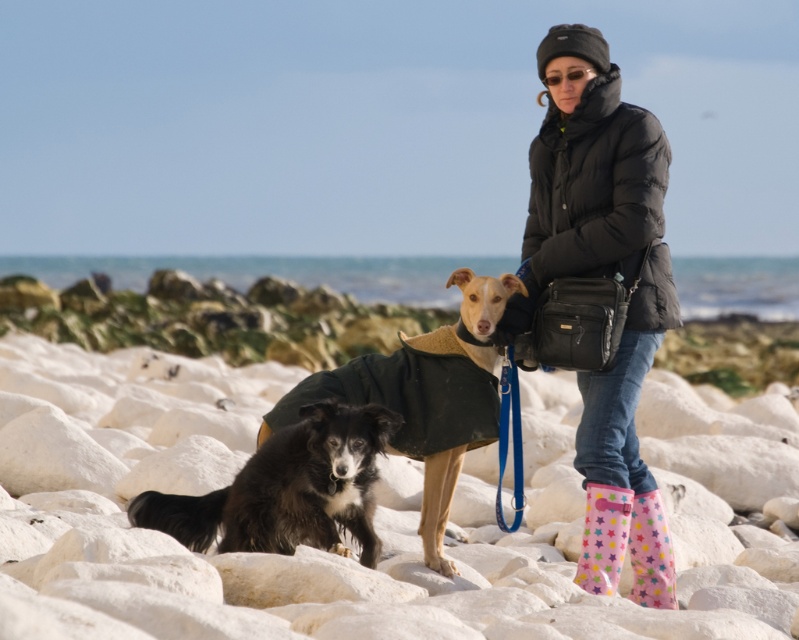
Question: Where is black puffer jacket at center located in relation to black puffy coat at upper right in the image?

Choices:
 (A) below
 (B) above

Answer: (A)

Question: Which of the following is the farthest from the observer?

Choices:
 (A) pink star-patterned rubber boot at lower center
 (B) pastel star-patterned rubber boot at lower right
 (C) shaggy black fur at center
 (D) black puffy coat at upper right

Answer: (B)

Question: Is white smooth rocks at center behind shaggy black fur at center?

Choices:
 (A) no
 (B) yes

Answer: (A)

Question: Does black puffy coat at upper right appear on the left side of black fur coat at center?

Choices:
 (A) no
 (B) yes

Answer: (A)

Question: Which object appears closest to the camera in this image?

Choices:
 (A) white smooth rocks at center
 (B) black puffy coat at upper right
 (C) pastel star-patterned rubber boot at lower right
 (D) pink star-patterned rubber boot at lower center

Answer: (A)

Question: Which point is closer to the camera taking this photo?

Choices:
 (A) (650, 573)
 (B) (169, 477)

Answer: (A)